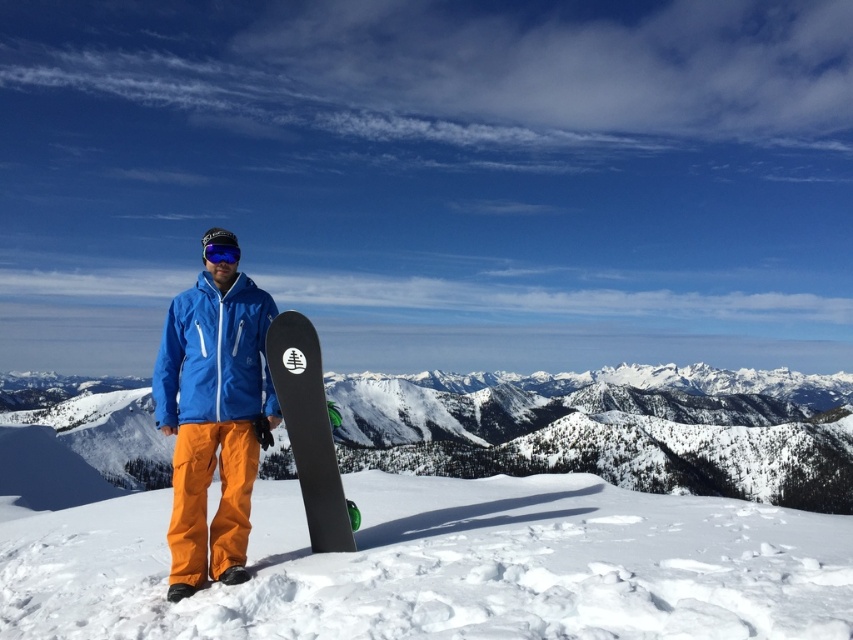
Question: From the image, what is the correct spatial relationship of snowy mountain at center in relation to matte blue jacket at center?

Choices:
 (A) left
 (B) right

Answer: (B)

Question: Can you confirm if white fluffy snow at center is bigger than blue reflective lens goggles at center?

Choices:
 (A) no
 (B) yes

Answer: (B)

Question: Is snowy mountain at center wider than black matte snowboard at center?

Choices:
 (A) yes
 (B) no

Answer: (A)

Question: Which of the following is the farthest from the observer?

Choices:
 (A) (268, 324)
 (B) (343, 506)
 (C) (231, 259)
 (D) (520, 410)

Answer: (D)

Question: Which object is positioned closest to the black matte snowboard at center?

Choices:
 (A) matte blue jacket at center
 (B) blue reflective lens goggles at center
 (C) snowy mountain at center
 (D) white fluffy snow at center

Answer: (A)

Question: Estimate the real-world distances between objects in this image. Which object is farther from the matte blue jacket at center?

Choices:
 (A) black matte snowboard at center
 (B) white fluffy snow at center
 (C) blue reflective lens goggles at center

Answer: (B)